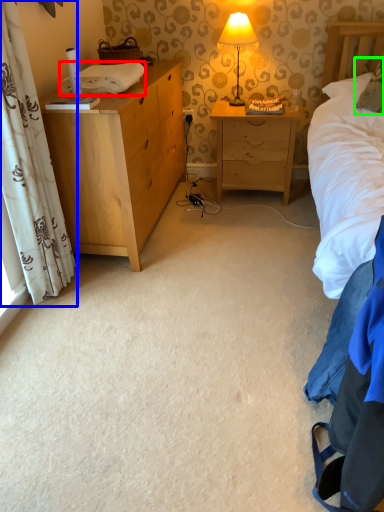
Question: Based on their relative distances, which object is nearer to cloth (highlighted by a red box)? Choose from curtain (highlighted by a blue box) and pillow (highlighted by a green box).

Choices:
 (A) curtain
 (B) pillow

Answer: (A)